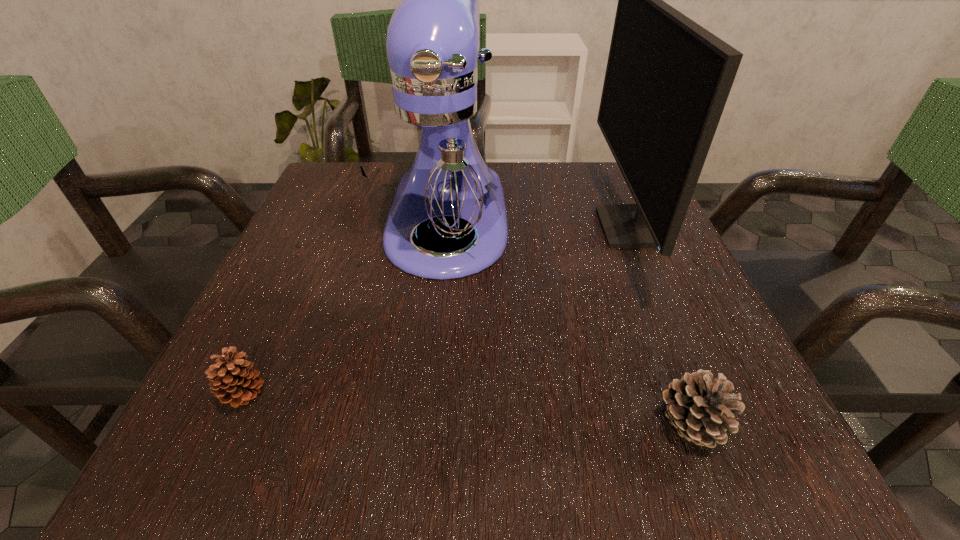
This screenshot has height=540, width=960. I want to click on mixer, so click(x=439, y=168).

Locate an element on the screen. The width and height of the screenshot is (960, 540). computer monitor is located at coordinates (667, 80).

Identify the location of the left pinecone. (231, 381).

Image resolution: width=960 pixels, height=540 pixels. I want to click on the right pinecone, so click(701, 410).

Identify the location of vacant space situated at the mixing area of the second object from left to right. The width and height of the screenshot is (960, 540). (428, 424).

Identify the location of blank area located on the front-facing side of the computer monitor. The height and width of the screenshot is (540, 960). (492, 228).

At what (x,y) coordinates should I click in order to perform the action: click on blank area located on the front-facing side of the computer monitor. Please return your answer as a coordinate pair (x, y). Looking at the image, I should click on (571, 228).

This screenshot has height=540, width=960. I want to click on vacant position located on the front-facing side of the computer monitor, so click(516, 228).

The width and height of the screenshot is (960, 540). What are the coordinates of `vacant space located on the back of the left pinecone` in the screenshot? It's located at (326, 215).

What are the coordinates of `vacant area located 0.270m on the left of the right pinecone` in the screenshot? It's located at (447, 424).